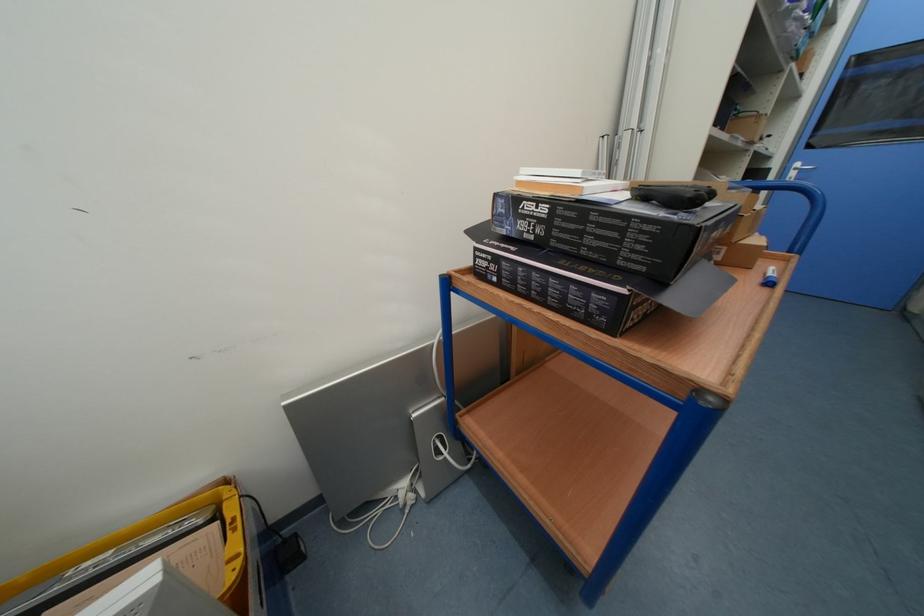
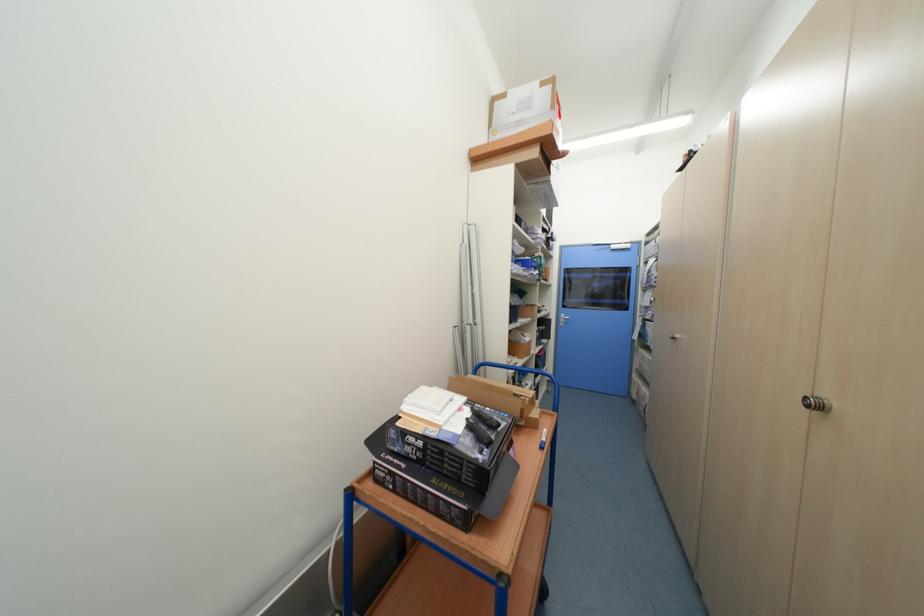
The first image is from the beginning of the video and the second image is from the end. How did the camera likely rotate when shooting the video?

The camera rotated toward right-up.